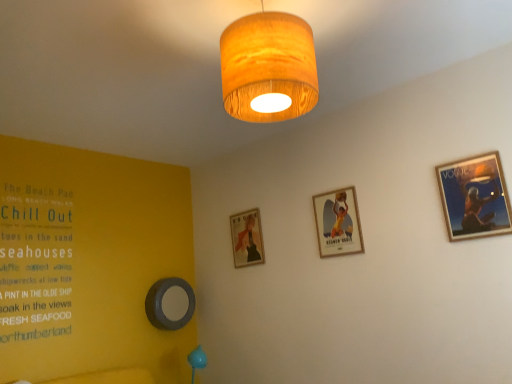
The height and width of the screenshot is (384, 512). What are the coordinates of `wooden framed poster at center, placed as the second picture frame when sorted from right to left` in the screenshot? It's located at tap(338, 223).

The image size is (512, 384). Describe the element at coordinates (268, 68) in the screenshot. I see `wooden drum lampshade at upper center` at that location.

I want to click on wooden framed poster at center, placed as the second picture frame when sorted from right to left, so click(x=338, y=223).

Does point (326, 194) come farther from viewer compared to point (155, 301)?

That is False.

Is wooden framed poster at center, which is the 3th picture frame in back-to-front order, taller than metallic gray circle at lower left, the first picture frame when ordered from left to right?

Yes, wooden framed poster at center, which is the 3th picture frame in back-to-front order, is taller than metallic gray circle at lower left, the first picture frame when ordered from left to right.

Where is `the 2nd picture frame to the right when counting from the metallic gray circle at lower left, marked as the 4th picture frame in a front-to-back arrangement`? The width and height of the screenshot is (512, 384). the 2nd picture frame to the right when counting from the metallic gray circle at lower left, marked as the 4th picture frame in a front-to-back arrangement is located at coordinates (338, 223).

From the image's perspective, is wooden framed poster at center, the 2th picture frame positioned from the front, on metallic gray circle at lower left, the fourth picture frame viewed from the right?

Yes, from the image's perspective, wooden framed poster at center, the 2th picture frame positioned from the front, is over metallic gray circle at lower left, the fourth picture frame viewed from the right.

Is metallic gray circle at lower left, the first picture frame when ordered from left to right, behind matte gold picture frame at center, the second picture frame from the left?

Yes.

Who is smaller, metallic gray circle at lower left, marked as the 4th picture frame in a front-to-back arrangement, or matte gold picture frame at center, which is counted as the 2th picture frame, starting from the back?

With smaller size is matte gold picture frame at center, which is counted as the 2th picture frame, starting from the back.

Looking at this image, considering the sizes of objects metallic gray circle at lower left, the fourth picture frame viewed from the right, and matte gold picture frame at center, the second picture frame from the left, in the image provided, who is shorter, metallic gray circle at lower left, the fourth picture frame viewed from the right, or matte gold picture frame at center, the second picture frame from the left,?

With less height is metallic gray circle at lower left, the fourth picture frame viewed from the right.

From the image's perspective, would you say metallic gray circle at lower left, marked as the 4th picture frame in a front-to-back arrangement, is positioned over matte gold picture frame at center, which is the third picture frame from right to left?

No.

From the image's perspective, is wooden framed poster at center, placed as the second picture frame when sorted from right to left, positioned above or below wooden drum lampshade at upper center?

From the image's perspective, wooden framed poster at center, placed as the second picture frame when sorted from right to left, appears below wooden drum lampshade at upper center.

Does wooden framed poster at center, placed as the second picture frame when sorted from right to left, come in front of wooden drum lampshade at upper center?

No, the depth of wooden framed poster at center, placed as the second picture frame when sorted from right to left, is greater than that of wooden drum lampshade at upper center.

Is wooden framed poster at center, the 2th picture frame positioned from the front, beside wooden drum lampshade at upper center?

No, wooden framed poster at center, the 2th picture frame positioned from the front, is not making contact with wooden drum lampshade at upper center.

From the picture: Which is more to the right, wooden drum lampshade at upper center or wooden framed poster at upper right, positioned as the first picture frame in right-to-left order?

Positioned to the right is wooden framed poster at upper right, positioned as the first picture frame in right-to-left order.

Is wooden framed poster at upper right, positioned as the first picture frame in right-to-left order, located within wooden drum lampshade at upper center?

No, wooden framed poster at upper right, positioned as the first picture frame in right-to-left order, is located outside of wooden drum lampshade at upper center.

From a real-world perspective, which object rests below the other?

matte gold picture frame at center, the third picture frame positioned from the front, from a real-world perspective.

Which object is thinner, matte gold picture frame at center, which is counted as the 2th picture frame, starting from the back, or wooden drum lampshade at upper center?

Thinner between the two is matte gold picture frame at center, which is counted as the 2th picture frame, starting from the back.

Measure the distance from matte gold picture frame at center, which is counted as the 2th picture frame, starting from the back, to wooden drum lampshade at upper center.

A distance of 1.78 meters exists between matte gold picture frame at center, which is counted as the 2th picture frame, starting from the back, and wooden drum lampshade at upper center.

Is matte gold picture frame at center, which is counted as the 2th picture frame, starting from the back, next to wooden drum lampshade at upper center?

No, matte gold picture frame at center, which is counted as the 2th picture frame, starting from the back, is not touching wooden drum lampshade at upper center.

Looking at the image, does wooden framed poster at upper right, positioned as the first picture frame in right-to-left order, seem bigger or smaller compared to wooden drum lampshade at upper center?

Considering their sizes, wooden framed poster at upper right, positioned as the first picture frame in right-to-left order, takes up less space than wooden drum lampshade at upper center.

Is point (489, 176) positioned before point (271, 95)?

No.

From the image's perspective, between wooden framed poster at upper right, the fourth picture frame when ordered from back to front, and wooden drum lampshade at upper center, which one is located above?

wooden drum lampshade at upper center, from the image's perspective.

Considering the positions of objects wooden framed poster at center, placed as the second picture frame when sorted from right to left, and wooden framed poster at upper right, positioned as the first picture frame in right-to-left order, in the image provided, who is more to the left, wooden framed poster at center, placed as the second picture frame when sorted from right to left, or wooden framed poster at upper right, positioned as the first picture frame in right-to-left order,?

From the viewer's perspective, wooden framed poster at center, placed as the second picture frame when sorted from right to left, appears more on the left side.

Which is correct: wooden framed poster at center, placed as the third picture frame when sorted from left to right, is inside wooden framed poster at upper right, the fourth picture frame when ordered from back to front, or outside of it?

wooden framed poster at center, placed as the third picture frame when sorted from left to right, is located beyond the bounds of wooden framed poster at upper right, the fourth picture frame when ordered from back to front.

Is the position of wooden framed poster at center, placed as the second picture frame when sorted from right to left, more distant than that of wooden framed poster at upper right, the fourth picture frame when ordered from back to front?

That is True.

From a real-world perspective, is wooden framed poster at center, placed as the third picture frame when sorted from left to right, above or below wooden framed poster at upper right, the fourth picture frame when ordered from back to front?

wooden framed poster at center, placed as the third picture frame when sorted from left to right, is situated higher than wooden framed poster at upper right, the fourth picture frame when ordered from back to front, in the real world.

From the image's perspective, which picture frame is the 2nd one below the wooden framed poster at center, placed as the second picture frame when sorted from right to left? Please provide its 2D coordinates.

[(170, 303)]

In order to click on the 3rd picture frame below the matte gold picture frame at center, the third picture frame positioned from the front (from a real-world perspective) in this screenshot , I will do `click(170, 303)`.

Based on their spatial positions, is wooden framed poster at upper right, positioned as the first picture frame in right-to-left order, or matte gold picture frame at center, which is counted as the 2th picture frame, starting from the back, further from metallic gray circle at lower left, the first picture frame when ordered from left to right?

wooden framed poster at upper right, positioned as the first picture frame in right-to-left order, is positioned further to the anchor metallic gray circle at lower left, the first picture frame when ordered from left to right.

When comparing their distances from wooden framed poster at center, placed as the second picture frame when sorted from right to left, does wooden framed poster at upper right, the 1th picture frame positioned from the front, or matte gold picture frame at center, which is the third picture frame from right to left, seem closer?

matte gold picture frame at center, which is the third picture frame from right to left.

When comparing their distances from matte gold picture frame at center, the third picture frame positioned from the front, does wooden framed poster at upper right, the fourth picture frame when ordered from back to front, or metallic gray circle at lower left, the fourth picture frame viewed from the right, seem closer?

metallic gray circle at lower left, the fourth picture frame viewed from the right, is positioned closer to the anchor matte gold picture frame at center, the third picture frame positioned from the front.

Estimate the real-world distances between objects in this image. Which object is further from wooden drum lampshade at upper center, wooden framed poster at upper right, the fourth picture frame when ordered from back to front, or matte gold picture frame at center, the second picture frame from the left?

matte gold picture frame at center, the second picture frame from the left, lies further to wooden drum lampshade at upper center than the other object.

Estimate the real-world distances between objects in this image. Which object is closer to wooden framed poster at upper right, which is the fourth picture frame in left-to-right order, wooden framed poster at center, placed as the third picture frame when sorted from left to right, or wooden drum lampshade at upper center?

wooden framed poster at center, placed as the third picture frame when sorted from left to right, is positioned closer to the anchor wooden framed poster at upper right, which is the fourth picture frame in left-to-right order.

Considering their positions, is metallic gray circle at lower left, the first picture frame positioned from the back, positioned further to wooden framed poster at center, which is the 3th picture frame in back-to-front order, than matte gold picture frame at center, which is the third picture frame from right to left?

metallic gray circle at lower left, the first picture frame positioned from the back, lies further to wooden framed poster at center, which is the 3th picture frame in back-to-front order, than the other object.

Based on their spatial positions, is wooden framed poster at center, the 2th picture frame positioned from the front, or metallic gray circle at lower left, the first picture frame positioned from the back, closer to matte gold picture frame at center, which is the third picture frame from right to left?

Based on the image, metallic gray circle at lower left, the first picture frame positioned from the back, appears to be nearer to matte gold picture frame at center, which is the third picture frame from right to left.

When comparing their distances from wooden framed poster at center, the 2th picture frame positioned from the front, does matte gold picture frame at center, the second picture frame from the left, or wooden framed poster at upper right, positioned as the first picture frame in right-to-left order, seem further?

wooden framed poster at upper right, positioned as the first picture frame in right-to-left order, is positioned further to the anchor wooden framed poster at center, the 2th picture frame positioned from the front.

Image resolution: width=512 pixels, height=384 pixels. What are the coordinates of `picture frame between metallic gray circle at lower left, the first picture frame when ordered from left to right, and wooden framed poster at center, the 2th picture frame positioned from the front, from left to right` in the screenshot? It's located at (247, 238).

You are a GUI agent. You are given a task and a screenshot of the screen. Output one action in this format:
    pyautogui.click(x=<x>, y=<y>)
    Task: Click on the picture frame between wooden drum lampshade at upper center and wooden framed poster at center, placed as the second picture frame when sorted from right to left, from front to back
    The image size is (512, 384).
    Given the screenshot: What is the action you would take?
    pyautogui.click(x=475, y=197)

At what (x,y) coordinates should I click in order to perform the action: click on picture frame between matte gold picture frame at center, the second picture frame from the left, and wooden framed poster at upper right, the fourth picture frame when ordered from back to front, in the horizontal direction. Please return your answer as a coordinate pair (x, y). This screenshot has width=512, height=384. Looking at the image, I should click on (338, 223).